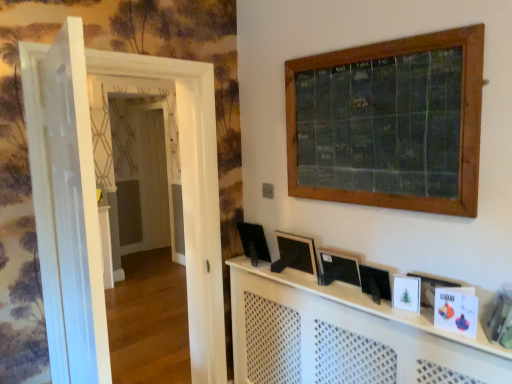
Where is `blank space above white perforated wood at center (from a real-world perspective)`? The image size is (512, 384). blank space above white perforated wood at center (from a real-world perspective) is located at coordinates (345, 290).